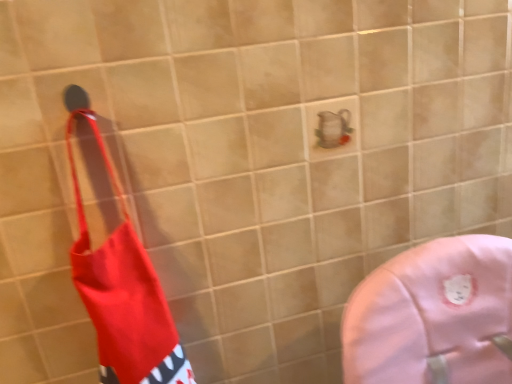
The width and height of the screenshot is (512, 384). What do you see at coordinates (124, 294) in the screenshot?
I see `matte red handbag at left` at bounding box center [124, 294].

This screenshot has width=512, height=384. In order to click on matte red handbag at left in this screenshot , I will do `click(124, 294)`.

The height and width of the screenshot is (384, 512). Identify the location of matte red handbag at left. (124, 294).